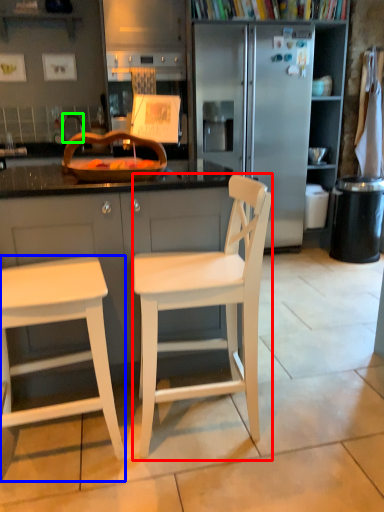
Question: Considering the real-world distances, which object is farthest from chair (highlighted by a red box)? stool (highlighted by a blue box) or faucet (highlighted by a green box)?

Choices:
 (A) stool
 (B) faucet

Answer: (B)